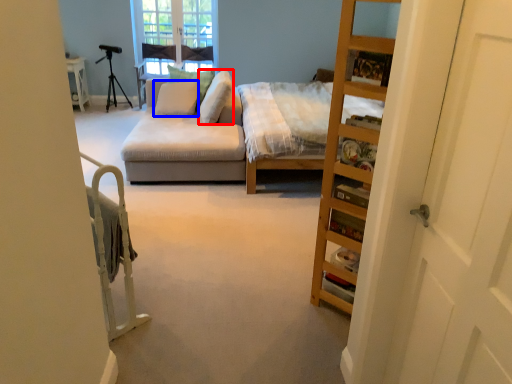
Question: Among these objects, which one is farthest to the camera, pillow (highlighted by a red box) or pillow (highlighted by a blue box)?

Choices:
 (A) pillow
 (B) pillow

Answer: (B)